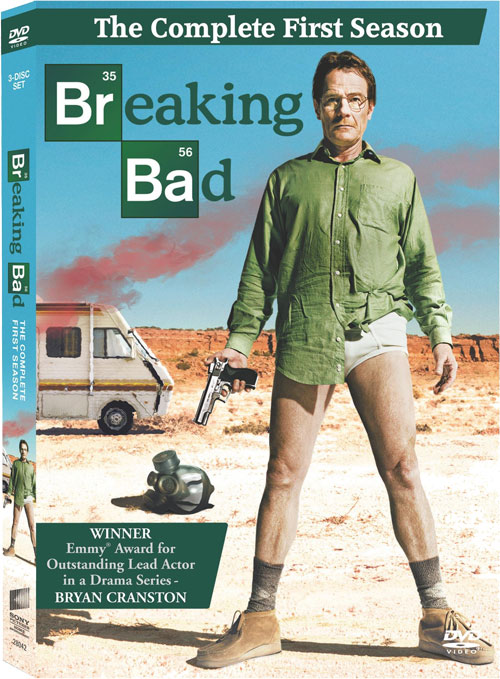
The width and height of the screenshot is (500, 679). What are the coordinates of `4 socks` in the screenshot? It's located at (437, 584), (274, 587), (34, 553), (14, 545).